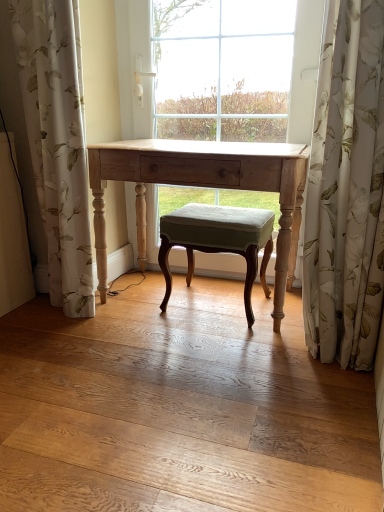
You are a GUI agent. You are given a task and a screenshot of the screen. Output one action in this format:
    pyautogui.click(x=<x>, y=<y>)
    Task: Click on the vacant area situated to the left side of velvet green stool at center
    
    Given the screenshot: What is the action you would take?
    pyautogui.click(x=141, y=305)